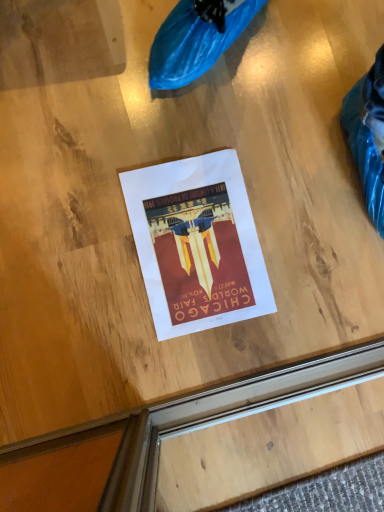
What do you see at coordinates (197, 243) in the screenshot?
I see `matte paper poster at center` at bounding box center [197, 243].

At what (x,y) coordinates should I click in order to perform the action: click on matte paper poster at center. Please return your answer as a coordinate pair (x, y). Looking at the image, I should click on (197, 243).

Image resolution: width=384 pixels, height=512 pixels. I want to click on matte paper poster at center, so click(x=197, y=243).